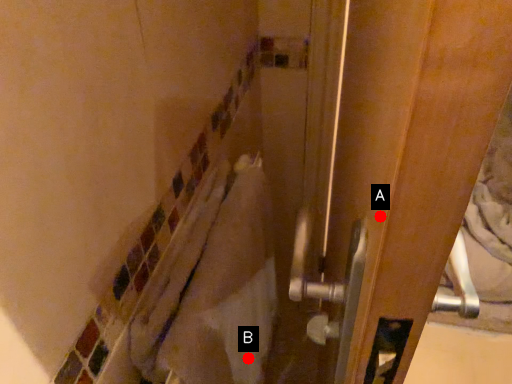
Question: Two points are circled on the image, labeled by A and B beside each circle. Which point is closer to the camera?

Choices:
 (A) A is closer
 (B) B is closer

Answer: (A)